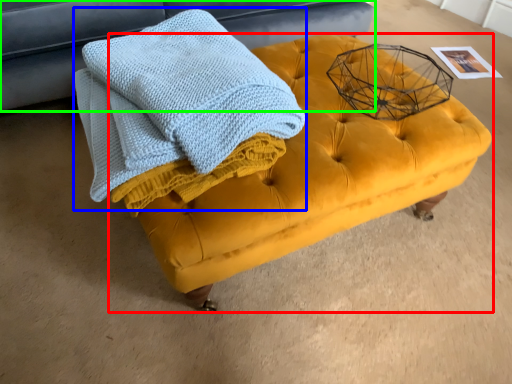
Question: Considering the real-world distances, which object is closest to table (highlighted by a red box)? bath towel (highlighted by a blue box) or furniture (highlighted by a green box).

Choices:
 (A) bath towel
 (B) furniture

Answer: (A)